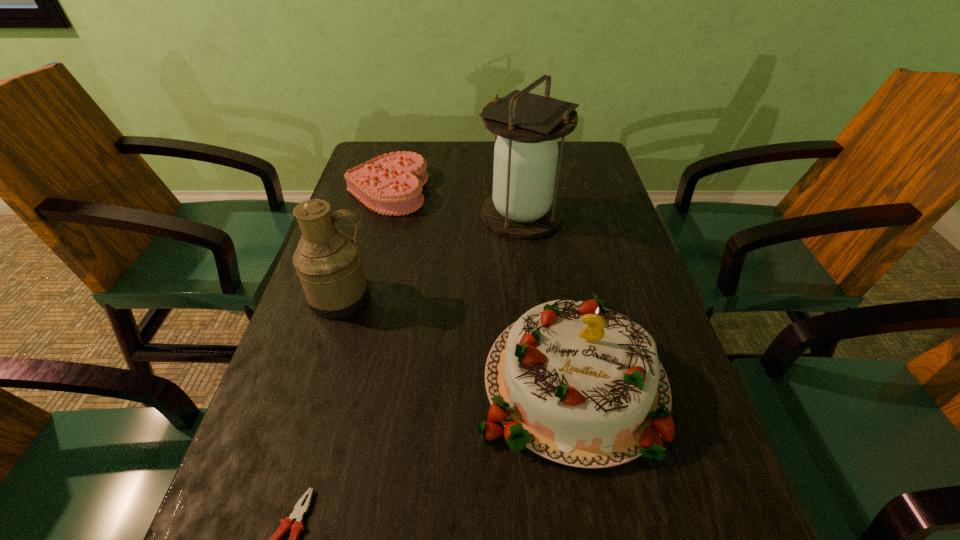
In order to click on lantern in this screenshot , I will do `click(523, 205)`.

What are the coordinates of `pitcher` in the screenshot? It's located at (327, 261).

Find the location of `the taller cake`. the taller cake is located at coordinates (581, 385).

You are a GUI agent. You are given a task and a screenshot of the screen. Output one action in this format:
    pyautogui.click(x=<x>, y=<y>)
    Task: Click on the nearer cake
    Image resolution: width=960 pixels, height=540 pixels.
    Given the screenshot: What is the action you would take?
    pyautogui.click(x=581, y=385)

Locate an element on the screen. The image size is (960, 540). the farther cake is located at coordinates (391, 184).

Identify the location of the shorter cake. This screenshot has width=960, height=540. pyautogui.click(x=391, y=184).

Find the location of `vacant space located 0.220m on the back of the tallest object`. vacant space located 0.220m on the back of the tallest object is located at coordinates (515, 153).

Locate an element on the screen. vacant space located on the back of the second tallest object is located at coordinates (374, 190).

The height and width of the screenshot is (540, 960). Identify the location of vacant point located on the back of the right cake. (551, 263).

At what (x,y) coordinates should I click in order to perform the action: click on free space located on the right of the farther cake. Please return your answer as a coordinate pair (x, y). The image size is (960, 540). Looking at the image, I should click on (566, 191).